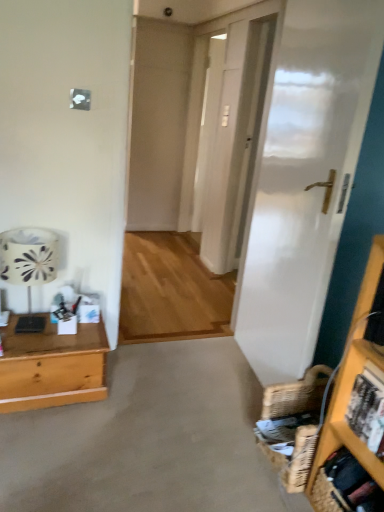
Question: From a real-world perspective, is beige carpet at lower center physically below woven brown basket at lower right?

Choices:
 (A) yes
 (B) no

Answer: (A)

Question: Is beige carpet at lower center oriented away from woven brown basket at lower right?

Choices:
 (A) yes
 (B) no

Answer: (B)

Question: Can you confirm if beige carpet at lower center is smaller than woven brown basket at lower right?

Choices:
 (A) no
 (B) yes

Answer: (A)

Question: From the image's perspective, is beige carpet at lower center under woven brown basket at lower right?

Choices:
 (A) no
 (B) yes

Answer: (B)

Question: Can you confirm if beige carpet at lower center is taller than woven brown basket at lower right?

Choices:
 (A) yes
 (B) no

Answer: (B)

Question: Is beige carpet at lower center surrounding woven brown basket at lower right?

Choices:
 (A) no
 (B) yes

Answer: (A)

Question: Is white fabric lampshade at left at the back of transparent glass door at center?

Choices:
 (A) yes
 (B) no

Answer: (B)

Question: Could you tell me if transparent glass door at center is facing white fabric lampshade at left?

Choices:
 (A) no
 (B) yes

Answer: (A)

Question: Is transparent glass door at center beside white fabric lampshade at left?

Choices:
 (A) yes
 (B) no

Answer: (B)

Question: Are transparent glass door at center and white fabric lampshade at left located far from each other?

Choices:
 (A) no
 (B) yes

Answer: (B)

Question: Does transparent glass door at center appear on the right side of white fabric lampshade at left?

Choices:
 (A) no
 (B) yes

Answer: (B)

Question: From a real-world perspective, is transparent glass door at center positioned over white fabric lampshade at left based on gravity?

Choices:
 (A) yes
 (B) no

Answer: (A)

Question: From a real-world perspective, is transparent glass door at center on top of wooden desk at left?

Choices:
 (A) no
 (B) yes

Answer: (B)